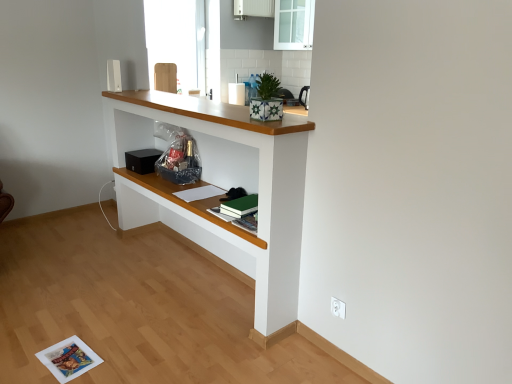
Question: Does white plastic electric outlet at lower right lie behind black matte speaker at center?

Choices:
 (A) yes
 (B) no

Answer: (B)

Question: Is white plastic electric outlet at lower right positioned with its back to black matte speaker at center?

Choices:
 (A) yes
 (B) no

Answer: (B)

Question: Is white plastic electric outlet at lower right to the left of black matte speaker at center from the viewer's perspective?

Choices:
 (A) no
 (B) yes

Answer: (A)

Question: Is white plastic electric outlet at lower right closer to camera compared to black matte speaker at center?

Choices:
 (A) no
 (B) yes

Answer: (B)

Question: Does white plastic electric outlet at lower right have a larger size compared to black matte speaker at center?

Choices:
 (A) yes
 (B) no

Answer: (B)

Question: Does white plastic electric outlet at lower right appear on the right side of black matte speaker at center?

Choices:
 (A) yes
 (B) no

Answer: (A)

Question: Is the depth of white painted wood shelf at center less than that of white plastic electric outlet at lower right?

Choices:
 (A) no
 (B) yes

Answer: (B)

Question: Is the position of white painted wood shelf at center more distant than that of white plastic electric outlet at lower right?

Choices:
 (A) no
 (B) yes

Answer: (A)

Question: From the image's perspective, would you say white painted wood shelf at center is positioned over white plastic electric outlet at lower right?

Choices:
 (A) yes
 (B) no

Answer: (A)

Question: Is white painted wood shelf at center next to white plastic electric outlet at lower right?

Choices:
 (A) no
 (B) yes

Answer: (A)

Question: Does white painted wood shelf at center have a greater width compared to white plastic electric outlet at lower right?

Choices:
 (A) yes
 (B) no

Answer: (A)

Question: Is white painted wood shelf at center located outside white plastic electric outlet at lower right?

Choices:
 (A) yes
 (B) no

Answer: (A)

Question: Considering the relative positions of white plastic electric outlet at lower right and white glossy cabinet at upper center in the image provided, is white plastic electric outlet at lower right to the right of white glossy cabinet at upper center from the viewer's perspective?

Choices:
 (A) no
 (B) yes

Answer: (B)